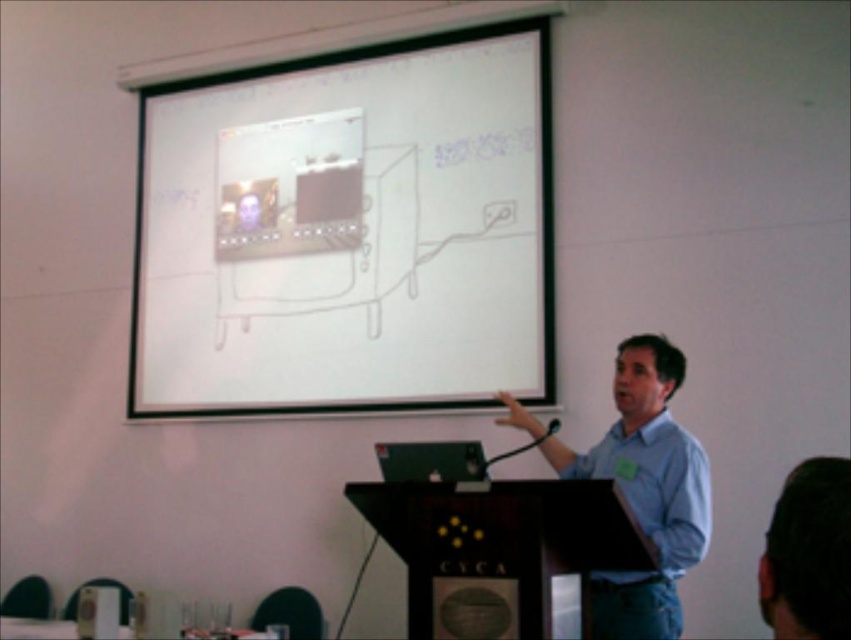
You are an event organizer checking the setup for a presentation. You notice the black wood podium at center and the matte blue shirt at center. Based on the scene, which object is shorter?

The black wood podium at center is shorter than the matte blue shirt at center.

You are standing at the point labeled point (x=524, y=563) in the presentation room. You want to take a photo of the presenter using a camera that has a 5.0 feet minimum focus distance. Can you take a clear photo of the presenter from your current position?

The distance between point (x=524, y=563) and the camera is 7.10 feet, which is greater than the camera minimum focus distance of 5.0 feet. Therefore, you can take a clear photo of the presenter from your current position.